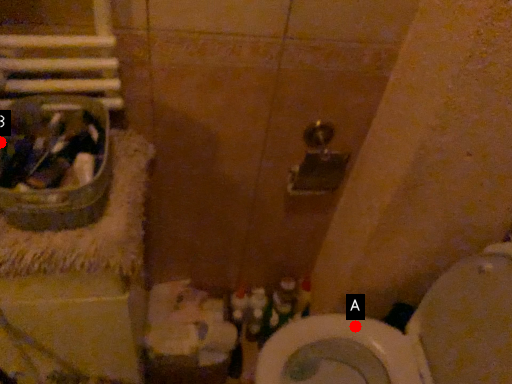
Question: Two points are circled on the image, labeled by A and B beside each circle. Which point is closer to the camera taking this photo?

Choices:
 (A) A is closer
 (B) B is closer

Answer: (B)